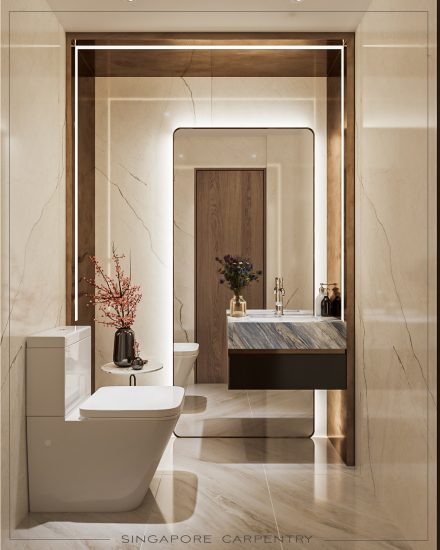
Locate an element on the screen. sink faucet is located at coordinates (277, 291).